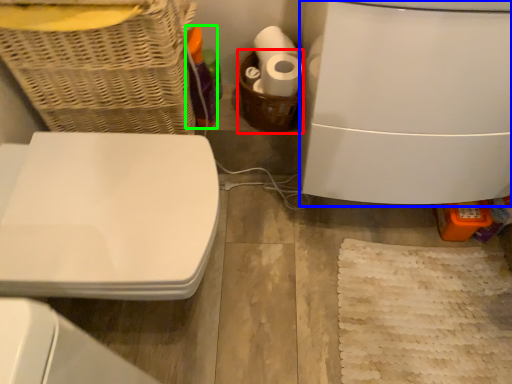
Question: Estimate the real-world distances between objects in this image. Which object is closer to basket (highlighted by a red box), appliance (highlighted by a blue box) or bottle (highlighted by a green box)?

Choices:
 (A) appliance
 (B) bottle

Answer: (B)